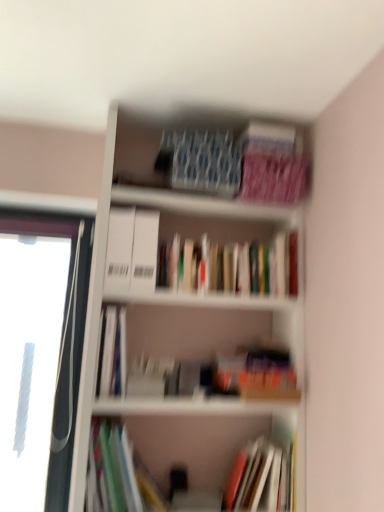
I want to click on hardcover book at center, the 2th book when ordered from top to bottom, so click(113, 354).

Image resolution: width=384 pixels, height=512 pixels. Describe the element at coordinates (273, 164) in the screenshot. I see `pink matte paperback book at upper right, placed as the first paperback book when sorted from right to left` at that location.

What is the approximate height of multicolored paper at lower left, the 3th book when ordered from top to bottom?

The height of multicolored paper at lower left, the 3th book when ordered from top to bottom, is 12.95 inches.

Image resolution: width=384 pixels, height=512 pixels. I want to click on hardcover books at center, which is the 1th book in top-to-bottom order, so point(233,266).

The width and height of the screenshot is (384, 512). Describe the element at coordinates (40, 355) in the screenshot. I see `white plastic window frame at left` at that location.

The width and height of the screenshot is (384, 512). Identify the location of white matte bookcase at upper center. (199, 296).

Is multicolored paper at lower left, which appears as the second book when ordered from the bottom, far away from hardcover books at center, the fourth book ordered from the bottom?

No, multicolored paper at lower left, which appears as the second book when ordered from the bottom, is not far from hardcover books at center, the fourth book ordered from the bottom.

From the image's perspective, between multicolored paper at lower left, the 3th book when ordered from top to bottom, and hardcover books at center, which is the 1th book in top-to-bottom order, who is located below?

multicolored paper at lower left, the 3th book when ordered from top to bottom, from the image's perspective.

Which is less distant, (100, 434) or (230, 269)?

Clearly, point (100, 434) is closer to the camera than point (230, 269).

Between multicolored paper at lower left, the 3th book when ordered from top to bottom, and hardcover books at center, the fourth book ordered from the bottom, which one has smaller width?

hardcover books at center, the fourth book ordered from the bottom.

From the image's perspective, which is below, hardcover book at center, the 1th book positioned from the bottom, or white plastic window frame at left?

hardcover book at center, the 1th book positioned from the bottom, appears lower in the image.

From a real-world perspective, is hardcover book at center, positioned as the fourth book in top-to-bottom order, under white plastic window frame at left?

Indeed, from a real-world perspective, hardcover book at center, positioned as the fourth book in top-to-bottom order, is positioned beneath white plastic window frame at left.

In terms of width, does hardcover book at center, positioned as the fourth book in top-to-bottom order, look wider or thinner when compared to white plastic window frame at left?

In the image, hardcover book at center, positioned as the fourth book in top-to-bottom order, appears to be wider than white plastic window frame at left.

Considering the sizes of hardcover book at center, the 2th book when ordered from top to bottom, and hardcover book at center, the 1th book positioned from the bottom, in the image, is hardcover book at center, the 2th book when ordered from top to bottom, bigger or smaller than hardcover book at center, the 1th book positioned from the bottom,?

Considering their sizes, hardcover book at center, the 2th book when ordered from top to bottom, takes up less space than hardcover book at center, the 1th book positioned from the bottom.

Is there a large distance between hardcover book at center, the 2th book when ordered from top to bottom, and hardcover book at center, positioned as the fourth book in top-to-bottom order?

Actually, hardcover book at center, the 2th book when ordered from top to bottom, and hardcover book at center, positioned as the fourth book in top-to-bottom order, are a little close together.

Considering the relative positions of hardcover book at center, the 2th book when ordered from top to bottom, and hardcover book at center, the 1th book positioned from the bottom, in the image provided, is hardcover book at center, the 2th book when ordered from top to bottom, to the left of hardcover book at center, the 1th book positioned from the bottom, from the viewer's perspective?

Yes.

Where is `bookcase that appears in front of the white plastic window frame at left`? The image size is (384, 512). bookcase that appears in front of the white plastic window frame at left is located at coordinates (199, 296).

Between white matte bookcase at upper center and white plastic window frame at left, which one has more height?

white matte bookcase at upper center is taller.

Based on the photo, which is more to the right, white matte bookcase at upper center or white plastic window frame at left?

From the viewer's perspective, white matte bookcase at upper center appears more on the right side.

Looking at this image, what's the angular difference between hardcover books at center, the fourth book ordered from the bottom, and hardcover book at center, the 1th book positioned from the bottom,'s facing directions?

The angle between the facing direction of hardcover books at center, the fourth book ordered from the bottom, and the facing direction of hardcover book at center, the 1th book positioned from the bottom, is 1.76 degrees.

Does point (162, 273) come in front of point (250, 449)?

Yes, point (162, 273) is closer to viewer.

Considering the positions of objects hardcover books at center, which is the 1th book in top-to-bottom order, and hardcover book at center, the 1th book positioned from the bottom, in the image provided, who is more to the left, hardcover books at center, which is the 1th book in top-to-bottom order, or hardcover book at center, the 1th book positioned from the bottom,?

hardcover books at center, which is the 1th book in top-to-bottom order.

How much distance is there between hardcover books at center, the fourth book ordered from the bottom, and hardcover book at center, the 1th book positioned from the bottom?

A distance of 28.61 inches exists between hardcover books at center, the fourth book ordered from the bottom, and hardcover book at center, the 1th book positioned from the bottom.

How far apart are white matte bookcase at upper center and blue textured paper at upper center, the 1th paperback book when ordered from left to right?

A distance of 13.13 inches exists between white matte bookcase at upper center and blue textured paper at upper center, the 1th paperback book when ordered from left to right.

Can you tell me how much white matte bookcase at upper center and blue textured paper at upper center, acting as the second paperback book starting from the right, differ in facing direction?

0.53 degrees.

From the picture: From a real-world perspective, between white matte bookcase at upper center and blue textured paper at upper center, the 1th paperback book when ordered from left to right, who is vertically higher?

blue textured paper at upper center, the 1th paperback book when ordered from left to right.

Locate an element on the screen. The image size is (384, 512). bookcase in front of the blue textured paper at upper center, acting as the second paperback book starting from the right is located at coordinates (199, 296).

Locate an element on the screen. Image resolution: width=384 pixels, height=512 pixels. window frame lying behind the blue textured paper at upper center, the 1th paperback book when ordered from left to right is located at coordinates (40, 355).

Is blue textured paper at upper center, acting as the second paperback book starting from the right, taller or shorter than white plastic window frame at left?

Clearly, blue textured paper at upper center, acting as the second paperback book starting from the right, is shorter compared to white plastic window frame at left.

From a real-world perspective, between blue textured paper at upper center, the 1th paperback book when ordered from left to right, and white plastic window frame at left, who is vertically lower?

In real-world perspective, white plastic window frame at left is lower.

Is point (212, 161) closer to camera compared to point (67, 358)?

That is True.

This screenshot has width=384, height=512. Identify the location of the 2nd book directly above the multicolored paper at lower left, the 3th book when ordered from top to bottom (from a real-world perspective). (233, 266).

From a real-world perspective, starting from the white plastic window frame at left, which book is the 2nd one below it? Please provide its 2D coordinates.

[(259, 478)]

Based on their spatial positions, is hardcover books at center, the fourth book ordered from the bottom, or hardcover book at center, which is the third book from bottom to top, closer to white plastic window frame at left?

hardcover book at center, which is the third book from bottom to top, lies closer to white plastic window frame at left than the other object.

Looking at the image, which one is located closer to white matte bookcase at upper center, multicolored paper at lower left, the 3th book when ordered from top to bottom, or hardcover books at center, the fourth book ordered from the bottom?

hardcover books at center, the fourth book ordered from the bottom, lies closer to white matte bookcase at upper center than the other object.

From the image, which object appears to be nearer to white plastic window frame at left, hardcover book at center, the 1th book positioned from the bottom, or hardcover book at center, the 2th book when ordered from top to bottom?

hardcover book at center, the 2th book when ordered from top to bottom, lies closer to white plastic window frame at left than the other object.

From the image, which object appears to be farther from pink matte paperback book at upper right, arranged as the 2th paperback book when viewed from the left, white matte bookcase at upper center or hardcover book at center, the 2th book when ordered from top to bottom?

hardcover book at center, the 2th book when ordered from top to bottom.

Which object lies further to the anchor point white matte bookcase at upper center, pink matte paperback book at upper right, arranged as the 2th paperback book when viewed from the left, or white plastic window frame at left?

white plastic window frame at left.

Which object lies further to the anchor point hardcover books at center, the fourth book ordered from the bottom, multicolored paper at lower left, which appears as the second book when ordered from the bottom, or hardcover book at center, the 1th book positioned from the bottom?

hardcover book at center, the 1th book positioned from the bottom, is further to hardcover books at center, the fourth book ordered from the bottom.

Based on the photo, which object lies nearer to the anchor point hardcover books at center, which is the 1th book in top-to-bottom order, blue textured paper at upper center, acting as the second paperback book starting from the right, or hardcover book at center, positioned as the fourth book in top-to-bottom order?

blue textured paper at upper center, acting as the second paperback book starting from the right, is positioned closer to the anchor hardcover books at center, which is the 1th book in top-to-bottom order.

Which object lies nearer to the anchor point white matte bookcase at upper center, blue textured paper at upper center, the 1th paperback book when ordered from left to right, or hardcover books at center, the fourth book ordered from the bottom?

hardcover books at center, the fourth book ordered from the bottom, is closer to white matte bookcase at upper center.

Locate an element on the screen. This screenshot has height=512, width=384. bookcase between blue textured paper at upper center, acting as the second paperback book starting from the right, and hardcover book at center, positioned as the fourth book in top-to-bottom order, in the vertical direction is located at coordinates (199, 296).

In order to click on bookcase between pink matte paperback book at upper right, arranged as the 2th paperback book when viewed from the left, and multicolored paper at lower left, the 3th book when ordered from top to bottom, vertically in this screenshot , I will do `click(199, 296)`.

Locate an element on the screen. book between hardcover books at center, the fourth book ordered from the bottom, and multicolored paper at lower left, the 3th book when ordered from top to bottom, in the vertical direction is located at coordinates (113, 354).

Find the location of a particular element. bookcase between blue textured paper at upper center, acting as the second paperback book starting from the right, and multicolored paper at lower left, which appears as the second book when ordered from the bottom, vertically is located at coordinates (199, 296).